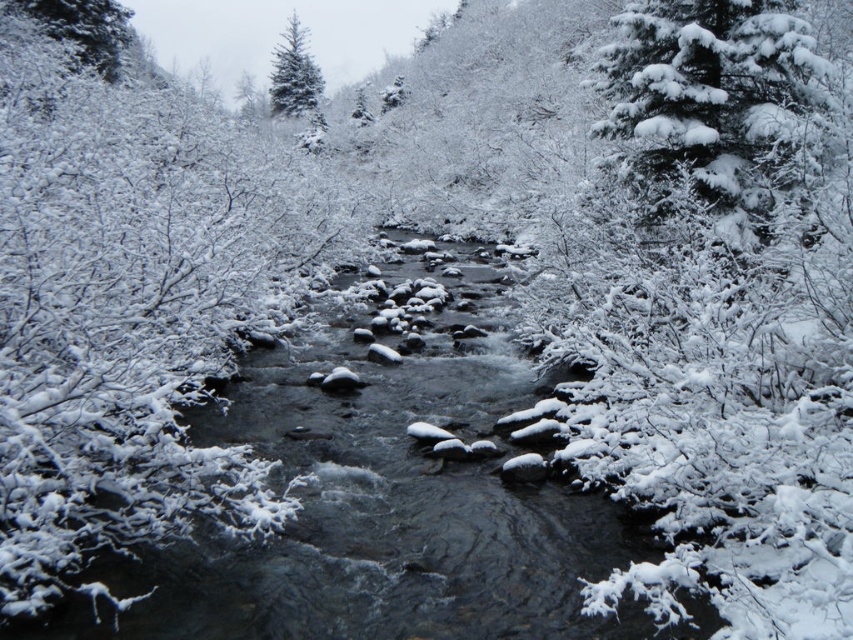
Question: Among these objects, which one is nearest to the camera?

Choices:
 (A) snow-covered evergreen tree at upper left
 (B) green matte evergreen tree at upper center

Answer: (A)

Question: Which point is closer to the camera taking this photo?

Choices:
 (A) (51, 6)
 (B) (283, 58)

Answer: (A)

Question: Does snow-covered evergreen at upper right come behind snow-covered evergreen tree at upper left?

Choices:
 (A) yes
 (B) no

Answer: (B)

Question: Which point is closer to the camera?

Choices:
 (A) (91, 12)
 (B) (297, 29)
 (C) (799, 131)

Answer: (C)

Question: Can you confirm if snow-covered evergreen at upper right is smaller than snow-covered evergreen tree at upper left?

Choices:
 (A) no
 (B) yes

Answer: (A)

Question: In this image, where is snow-covered evergreen tree at upper left located relative to green matte evergreen tree at upper center?

Choices:
 (A) left
 (B) right

Answer: (B)